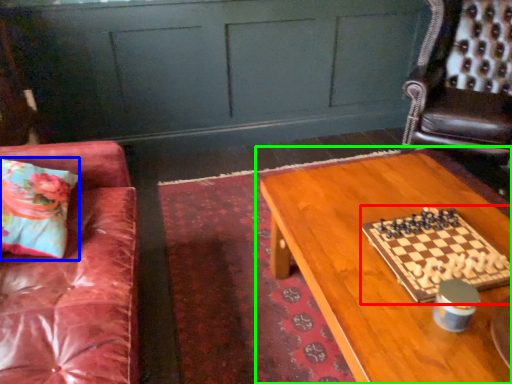
Question: Which object is positioned farthest from board game (highlighted by a red box)? Select from pillow (highlighted by a blue box) and table (highlighted by a green box).

Choices:
 (A) pillow
 (B) table

Answer: (A)